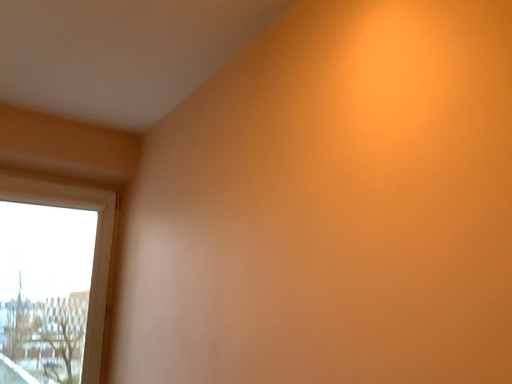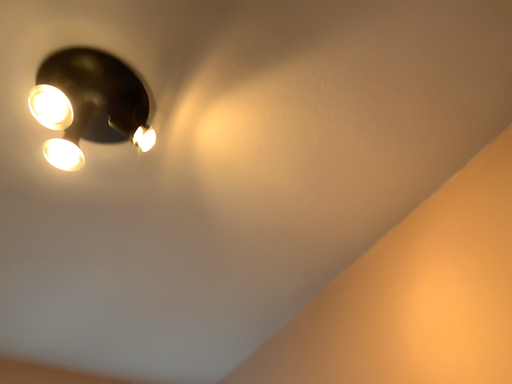
Question: Which way did the camera rotate in the video?

Choices:
 (A) rotated upward
 (B) rotated downward

Answer: (A)